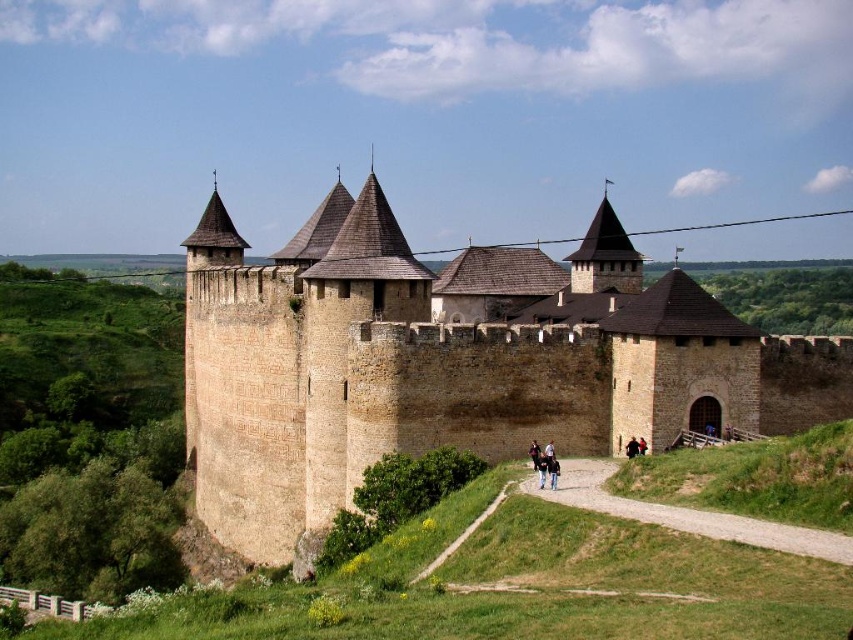
Looking at this image, you are standing at the base of the castle hill and want to reach the point marked as point [209,488]. If your walking speed is 3 feet per second, approximately how many seconds will it take you to reach that point?

The distance of point [209,488] from viewer is 316.26 feet. At a speed of 3 feet per second, it would take approximately 105.42 seconds, which rounds to about 105 seconds to reach the point.